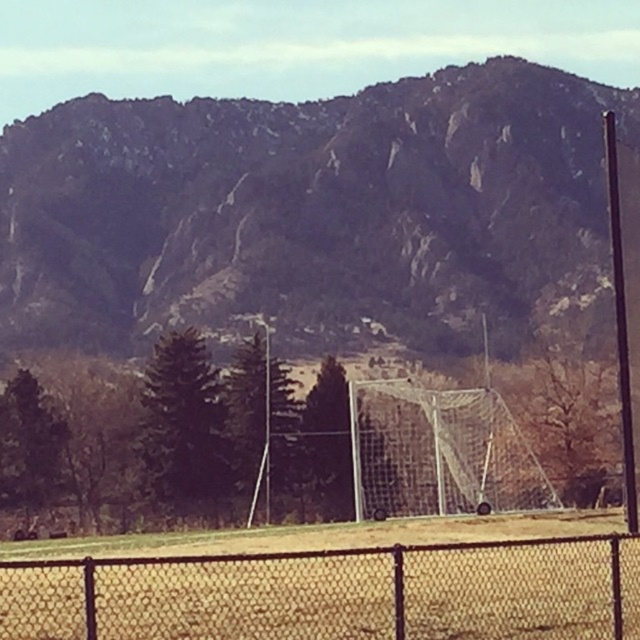
Between rugged rock mountain at upper center and black chain-link fence at lower center, which one is positioned lower?

Positioned lower is black chain-link fence at lower center.

Who is taller, rugged rock mountain at upper center or black chain-link fence at lower center?

Standing taller between the two is rugged rock mountain at upper center.

You are a GUI agent. You are given a task and a screenshot of the screen. Output one action in this format:
    pyautogui.click(x=<x>, y=<y>)
    Task: Click on the rugged rock mountain at upper center
    
    Given the screenshot: What is the action you would take?
    pyautogui.click(x=305, y=205)